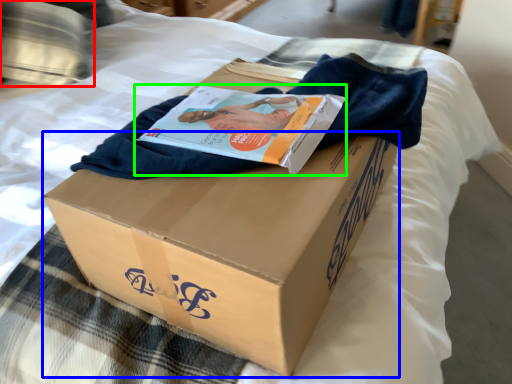
Question: Based on their relative distances, which object is farther from pillow (highlighted by a red box)? Choose from cardboard box (highlighted by a blue box) and magazine (highlighted by a green box).

Choices:
 (A) cardboard box
 (B) magazine

Answer: (A)